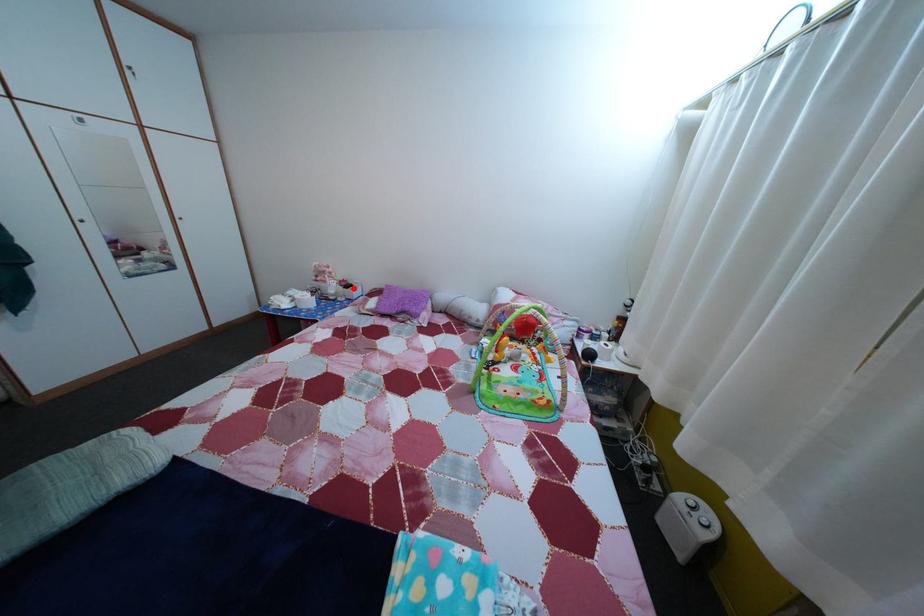
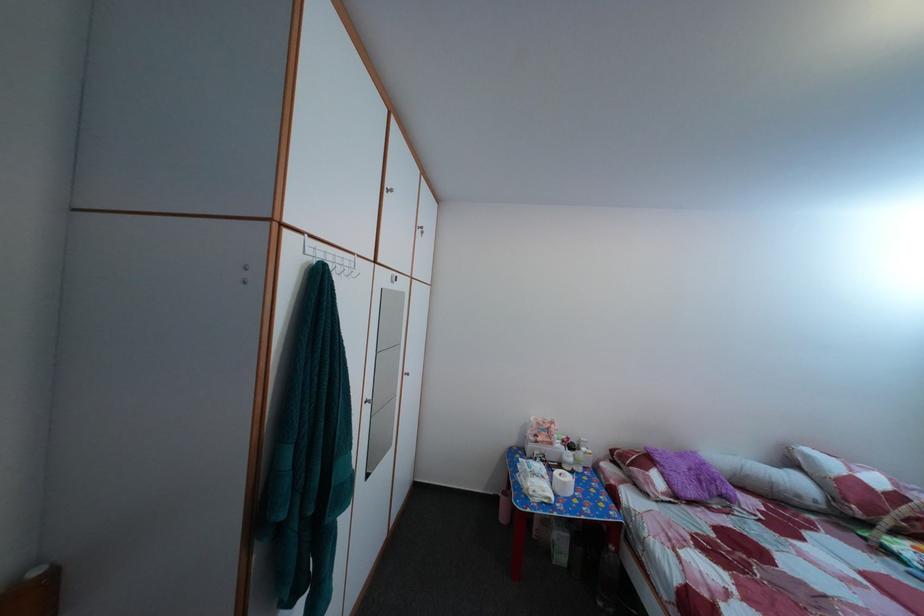
Locate, in the second image, the point that corresponds to the highlighted location in the first image.

(578, 447)